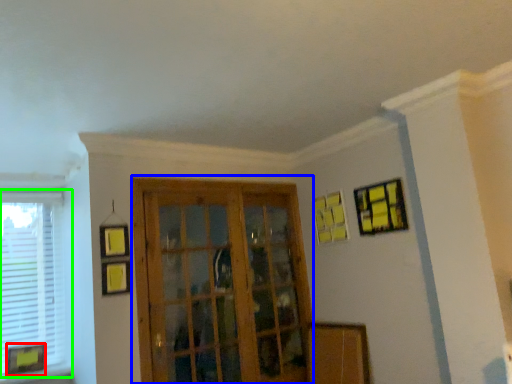
Question: Which is farther away from picture frame (highlighted by a red box)? screen door (highlighted by a blue box) or window (highlighted by a green box)?

Choices:
 (A) screen door
 (B) window

Answer: (A)